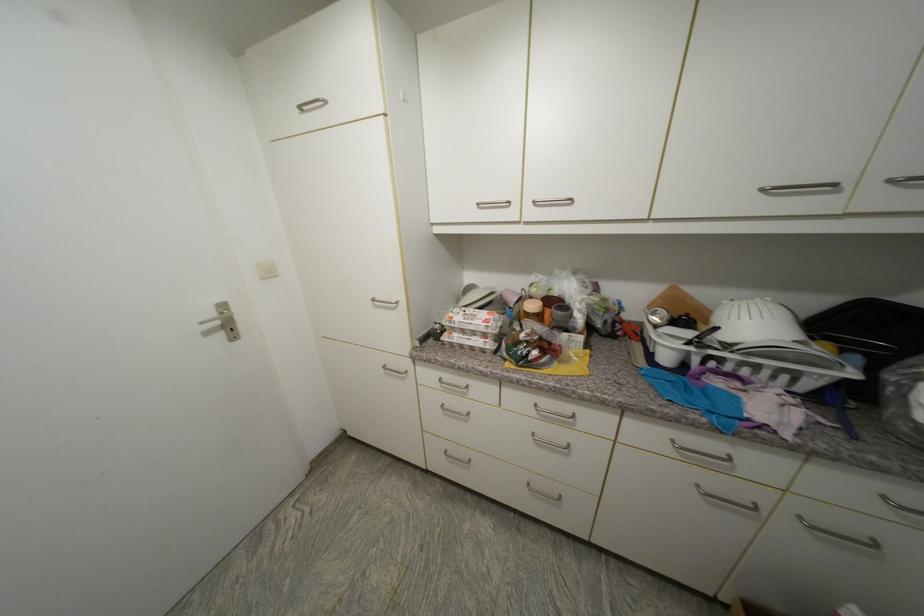
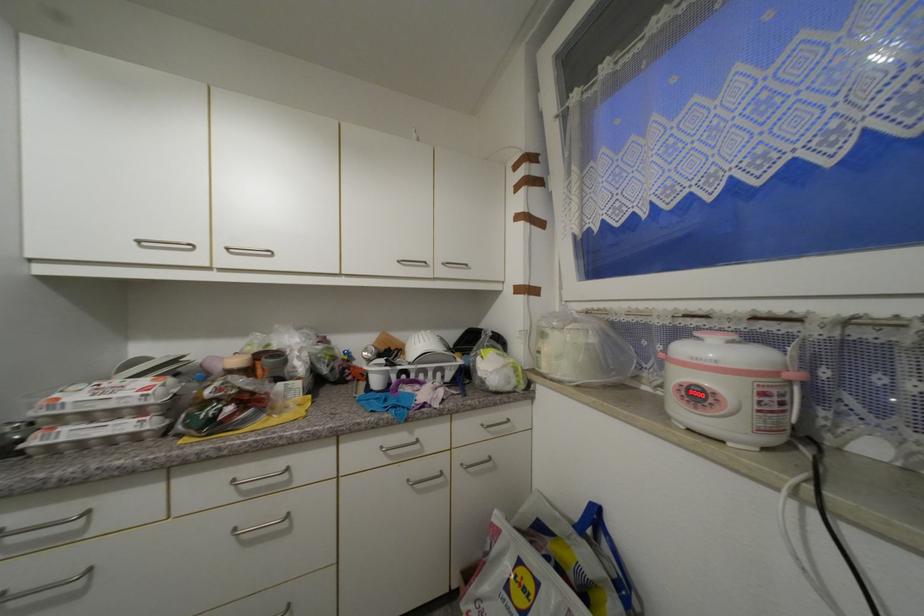
Locate, in the second image, the point that corresponds to (x=541, y=407) in the first image.

(238, 483)